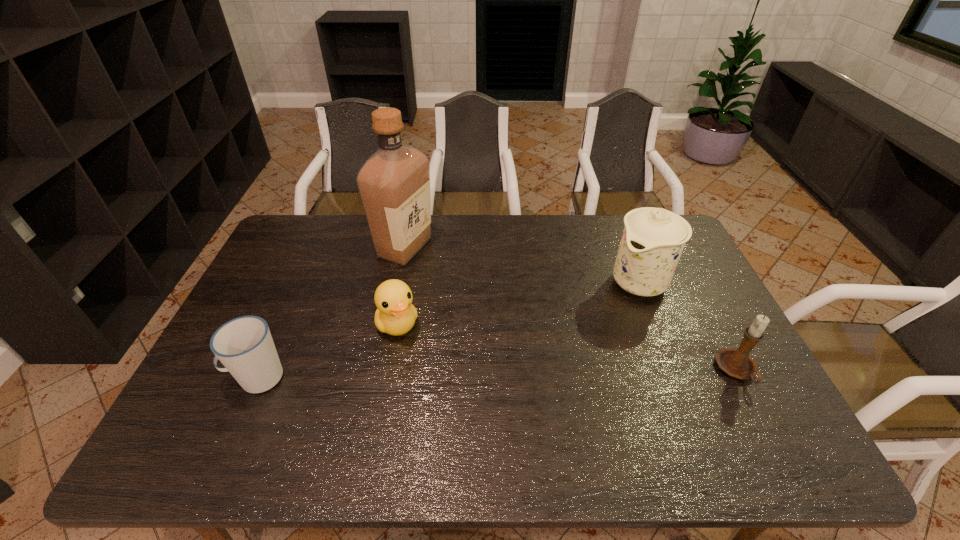
Locate an element on the screen. Image resolution: width=960 pixels, height=540 pixels. cup is located at coordinates (244, 345).

You are a GUI agent. You are given a task and a screenshot of the screen. Output one action in this format:
    pyautogui.click(x=<x>, y=<y>)
    Task: Click on the candle holder
    
    Given the screenshot: What is the action you would take?
    pyautogui.click(x=737, y=363)

The image size is (960, 540). What are the coordinates of `liquor` in the screenshot? It's located at (394, 183).

Where is `the fourth shortest object`? The width and height of the screenshot is (960, 540). the fourth shortest object is located at coordinates (653, 239).

Locate an element on the screen. The image size is (960, 540). the third farthest object is located at coordinates (395, 315).

Locate an element on the screen. This screenshot has width=960, height=540. free space located 0.060m with a handle on the side of the leftmost object is located at coordinates (205, 377).

The height and width of the screenshot is (540, 960). Find the location of `vacant space located on the side of the candle holder with the handle`. vacant space located on the side of the candle holder with the handle is located at coordinates (759, 413).

Locate an element on the screen. This screenshot has height=540, width=960. free space located on the front-facing side of the liquor is located at coordinates (431, 284).

Where is `vacant space situated 0.060m on the front-facing side of the liquor`? This screenshot has width=960, height=540. vacant space situated 0.060m on the front-facing side of the liquor is located at coordinates (425, 276).

Locate an element on the screen. This screenshot has height=540, width=960. vacant space situated on the front-facing side of the liquor is located at coordinates (439, 293).